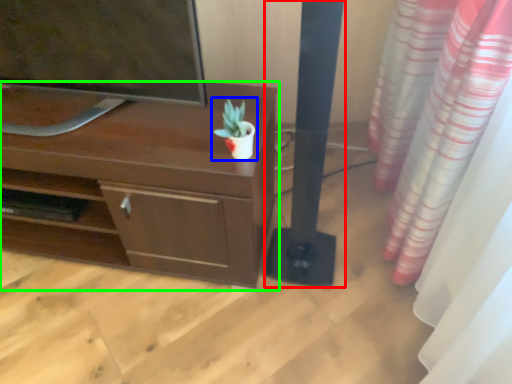
Question: Which is nearer to the pillar (highlighted by a red box)? houseplant (highlighted by a blue box) or desk (highlighted by a green box).

Choices:
 (A) houseplant
 (B) desk

Answer: (A)